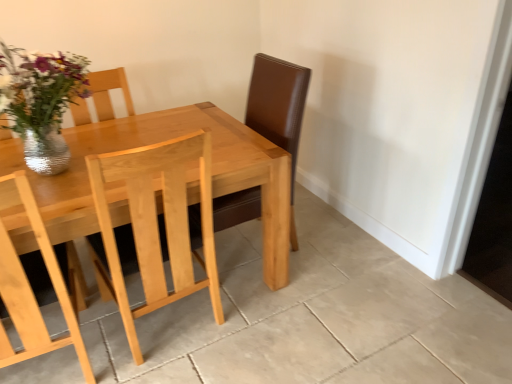
Question: Is metallic silver vase at upper left shorter than light wood table at center?

Choices:
 (A) no
 (B) yes

Answer: (B)

Question: Is metallic silver vase at upper left positioned behind light wood table at center?

Choices:
 (A) no
 (B) yes

Answer: (B)

Question: Does metallic silver vase at upper left have a lesser width compared to light wood table at center?

Choices:
 (A) yes
 (B) no

Answer: (A)

Question: Is metallic silver vase at upper left oriented towards light wood table at center?

Choices:
 (A) yes
 (B) no

Answer: (B)

Question: From a real-world perspective, is metallic silver vase at upper left physically below light wood table at center?

Choices:
 (A) no
 (B) yes

Answer: (A)

Question: In the image, is light wood chair at center positioned in front of or behind metallic silver vase at upper left?

Choices:
 (A) behind
 (B) front

Answer: (B)

Question: Considering the positions of light wood chair at center and metallic silver vase at upper left in the image, is light wood chair at center taller or shorter than metallic silver vase at upper left?

Choices:
 (A) tall
 (B) short

Answer: (A)

Question: Would you say light wood chair at center is to the left or to the right of metallic silver vase at upper left in the picture?

Choices:
 (A) left
 (B) right

Answer: (B)

Question: Looking at the image, does light wood chair at center seem bigger or smaller compared to metallic silver vase at upper left?

Choices:
 (A) big
 (B) small

Answer: (A)

Question: Is point (130, 182) positioned closer to the camera than point (272, 226)?

Choices:
 (A) farther
 (B) closer

Answer: (B)

Question: Is light wood chair at center in front of or behind light wood table at center in the image?

Choices:
 (A) behind
 (B) front

Answer: (A)

Question: Is light wood chair at center spatially inside light wood table at center, or outside of it?

Choices:
 (A) inside
 (B) outside

Answer: (A)

Question: From the image's perspective, is light wood chair at center above or below light wood table at center?

Choices:
 (A) below
 (B) above

Answer: (A)

Question: Considering the relative positions of metallic silver vase at upper left and light wood chair at center in the image provided, is metallic silver vase at upper left to the left or to the right of light wood chair at center?

Choices:
 (A) right
 (B) left

Answer: (B)

Question: Relative to light wood chair at center, is metallic silver vase at upper left in front or behind?

Choices:
 (A) behind
 (B) front

Answer: (A)